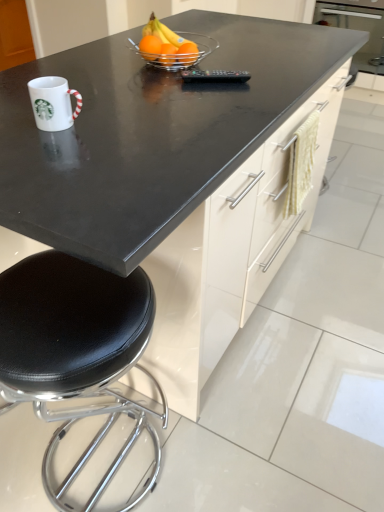
Find the location of `vacant point to the left of black plastic remote at center`. vacant point to the left of black plastic remote at center is located at coordinates tap(176, 80).